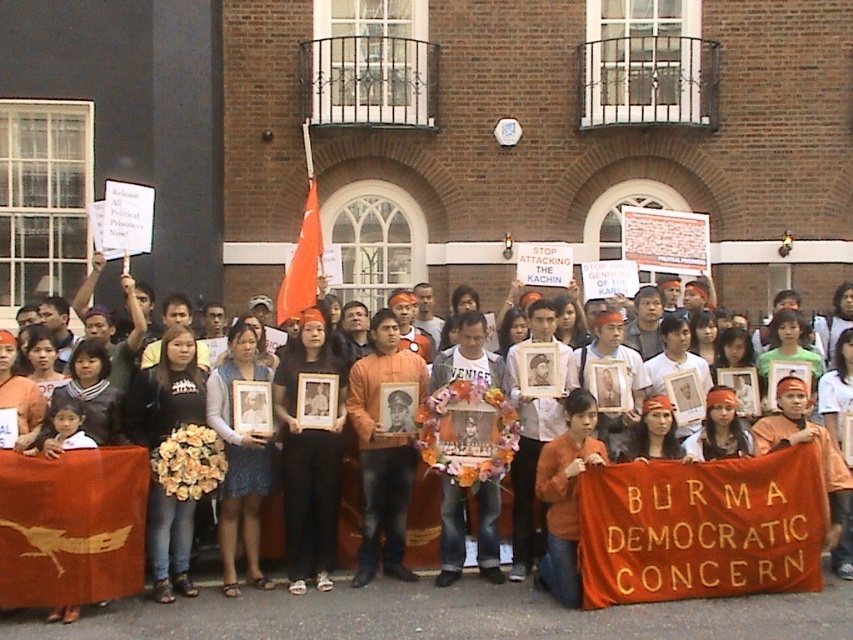
Question: Which object appears farthest from the camera in this image?

Choices:
 (A) blue sequined dress at center
 (B) orange fabric headband at center
 (C) orange fabric flag at center

Answer: (C)

Question: Can you confirm if orange fabric headband at center is wider than black fabric at center?

Choices:
 (A) no
 (B) yes

Answer: (B)

Question: Which of these objects is positioned closest to the blue sequined dress at center?

Choices:
 (A) orange fabric headband at center
 (B) orange fabric flag at center

Answer: (A)

Question: From the image, what is the correct spatial relationship of orange fabric headband at center in relation to orange fabric flag at center?

Choices:
 (A) below
 (B) above

Answer: (A)

Question: Which object is positioned closest to the orange fabric flag at center?

Choices:
 (A) blue sequined dress at center
 (B) orange fabric headband at center

Answer: (A)

Question: Can you confirm if orange fabric headband at center is positioned above orange fabric flag at center?

Choices:
 (A) yes
 (B) no

Answer: (B)